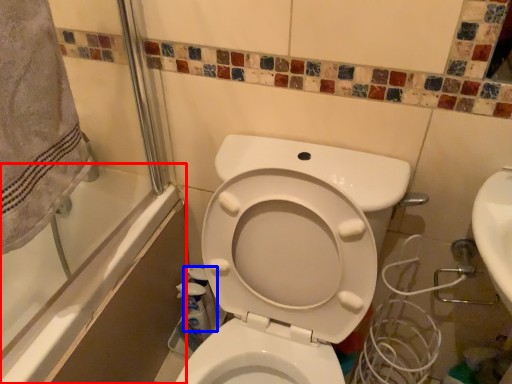
Question: Which of the following is the closest to the observer, bath (highlighted by a red box) or cleaning product (highlighted by a blue box)?

Choices:
 (A) bath
 (B) cleaning product

Answer: (A)